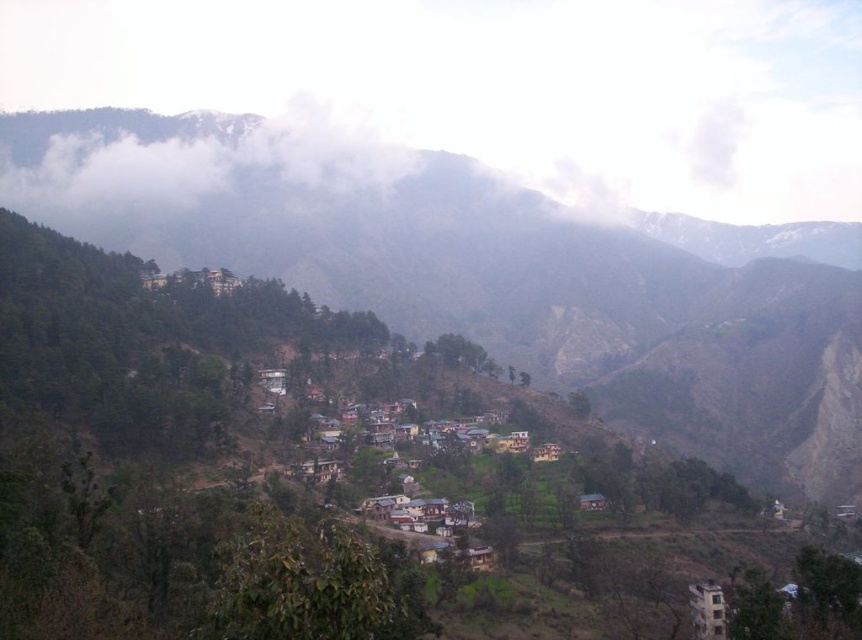
You are an airplane pilot flying over the mountainous landscape. You notice the green textured hillside at center and the white fluffy cloud at upper center. Which object is positioned higher in the sky?

The white fluffy cloud at upper center is positioned higher in the sky than the green textured hillside at center.

You are standing at the center of the image and want to reach the village located at the base of the mountains. Which direction should you move relative to the green textured hillside at center?

The green textured hillside at center is located at point (x=522, y=284), so you should move downward from the green textured hillside at center to reach the village at the base of the mountains.

You are standing in the village and looking towards the green textured hillside at center and the white fluffy cloud at upper center. Which object is located to the right of the other?

The green textured hillside at center is positioned on the right side of white fluffy cloud at upper center.